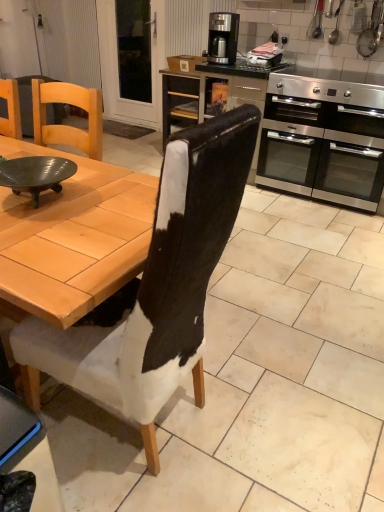
The image size is (384, 512). What are the coordinates of `free space in front of matte black bowl at left` in the screenshot? It's located at (43, 234).